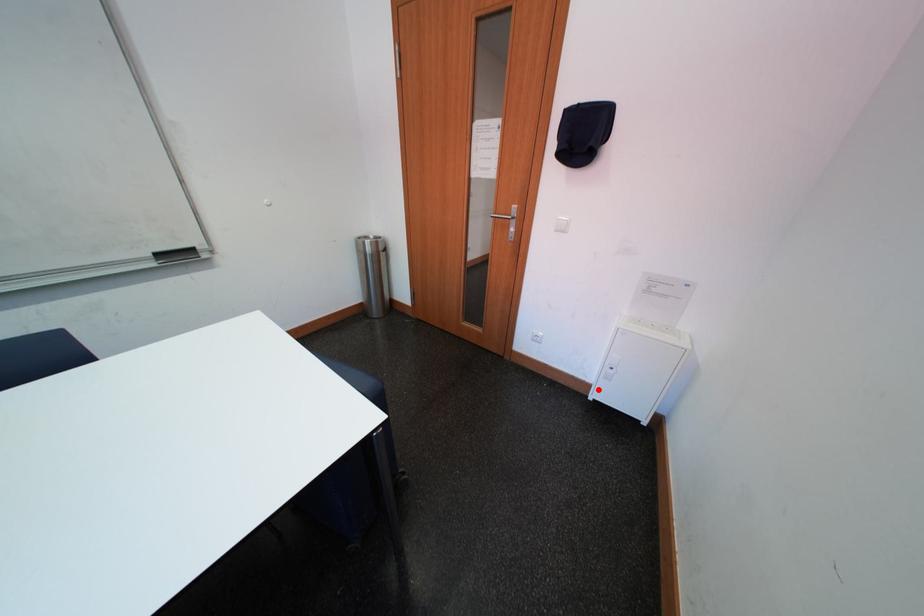
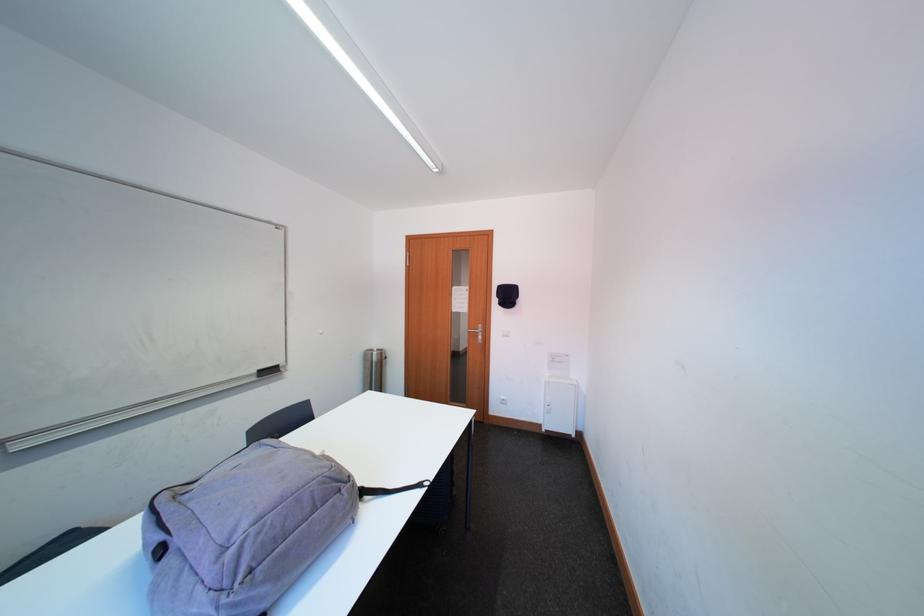
The point at the highlighted location is marked in the first image. Where is the corresponding point in the second image?

(551, 429)